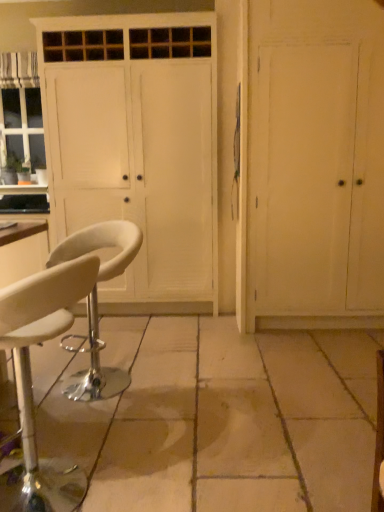
I want to click on free space behind white leather stool at lower left, placed as the 1th chair when sorted from front to back, so click(99, 419).